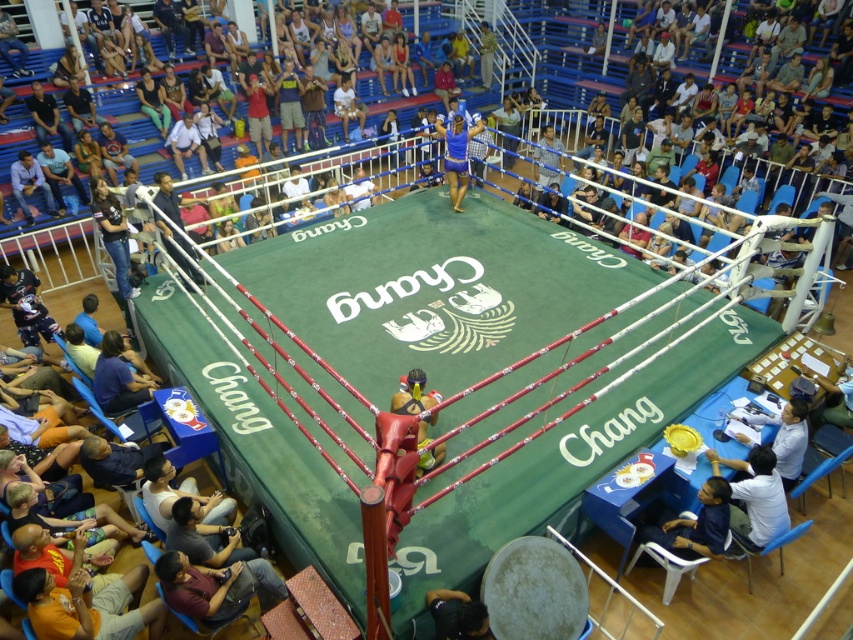
Question: Among these objects, which one is nearest to the camera?

Choices:
 (A) dark blue shirt at lower right
 (B) blue fabric shorts at center
 (C) black leather shoe at lower center

Answer: (C)

Question: Which object appears farthest from the camera in this image?

Choices:
 (A) yellow fabric boxer at lower left
 (B) dark blue shirt at lower right
 (C) maroon fabric shirt at lower left
 (D) black leather shoe at lower center

Answer: (B)

Question: Is light blue shirt at lower right positioned at the back of blue fabric shorts at center?

Choices:
 (A) yes
 (B) no

Answer: (B)

Question: Which object appears farthest from the camera in this image?

Choices:
 (A) light blue shirt at lower right
 (B) blue fabric shorts at center
 (C) maroon fabric shirt at lower left
 (D) yellow fabric boxer at lower left

Answer: (B)

Question: Is light blue shirt at lower right positioned behind black leather shoe at lower center?

Choices:
 (A) no
 (B) yes

Answer: (B)

Question: Can you confirm if maroon fabric shirt at lower left is positioned to the left of blue fabric shorts at center?

Choices:
 (A) no
 (B) yes

Answer: (B)